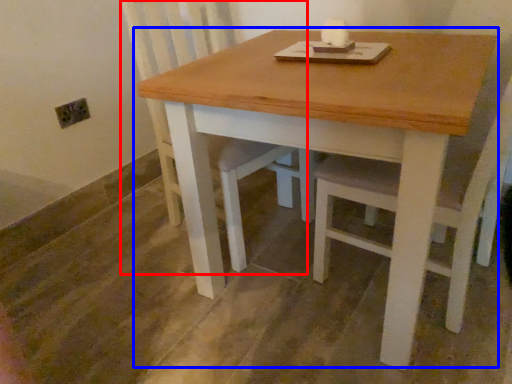
Question: Which point is further to the camera, swivel chair (highlighted by a red box) or table (highlighted by a blue box)?

Choices:
 (A) swivel chair
 (B) table

Answer: (A)